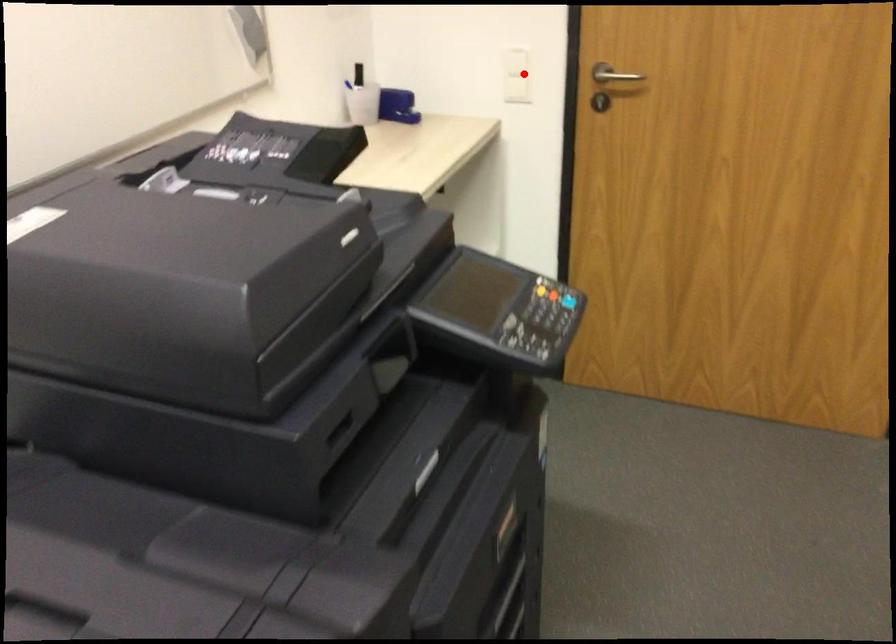
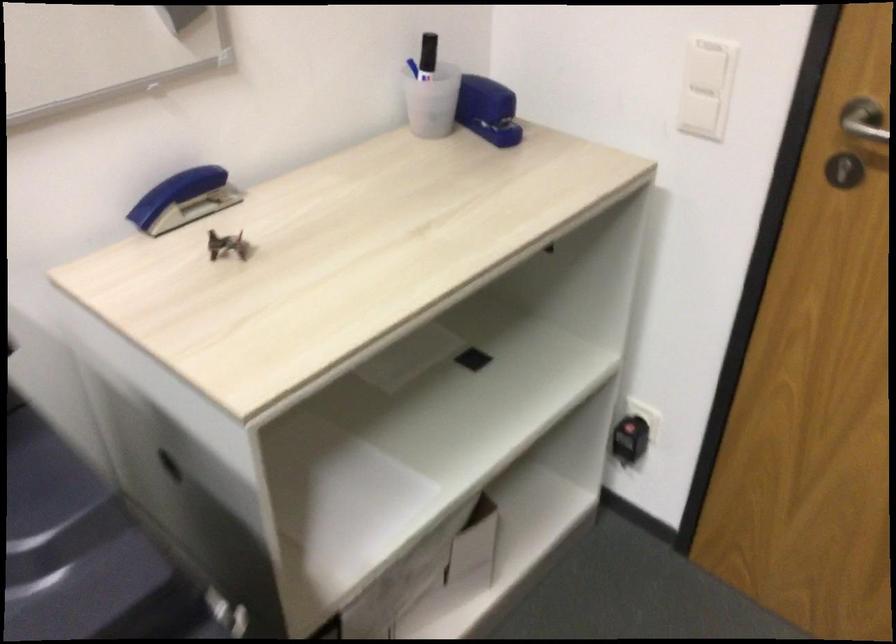
In the second image, find the point that corresponds to the highlighted location in the first image.

(707, 87)